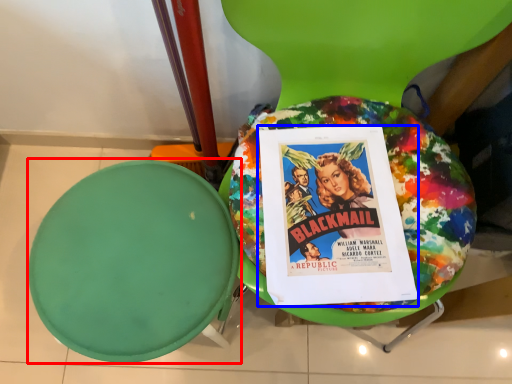
Question: Which of the following is the farthest to the observer, round table (highlighted by a red box) or comic book (highlighted by a blue box)?

Choices:
 (A) round table
 (B) comic book

Answer: (B)